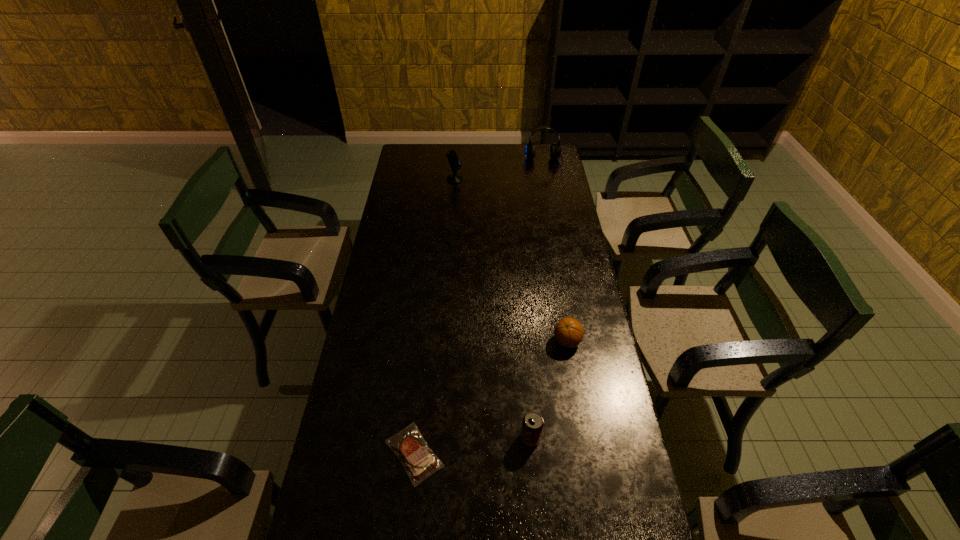
This screenshot has height=540, width=960. In order to click on vacant area in the image that satisfies the following two spatial constraints: 1. on the stand of the fourth nearest object; 2. on the back side of the third object from right to left in this screenshot , I will do `click(437, 437)`.